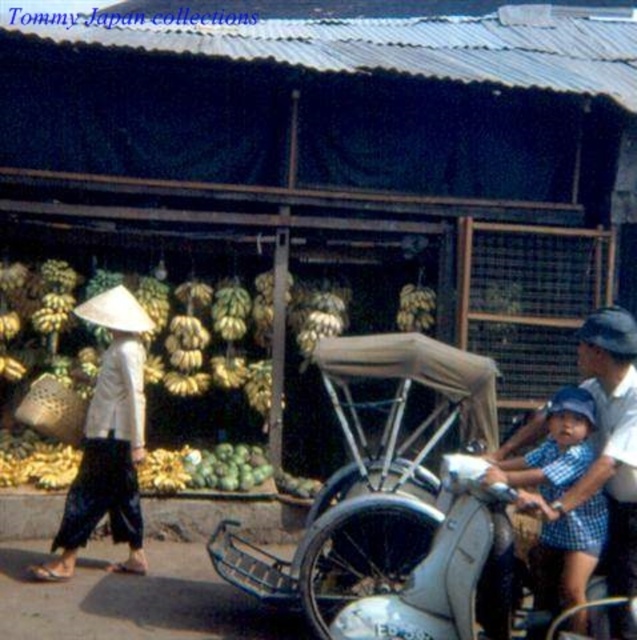
You are a tourist who wants to buy a souvenir. The vendor is standing near the white matte conical hat at left. Where should you look to find the vendor?

The vendor is near the white matte conical hat at left located at point (108, 442).

You are standing at the entrance of a market and see the white matte conical hat at left. If you want to reach it in 3 seconds, what is the minimum speed you need to walk towards it?

The white matte conical hat at left is 6.75 meters away. To reach it in 3 seconds, you need to walk at a minimum speed of 2.25 meters per second.